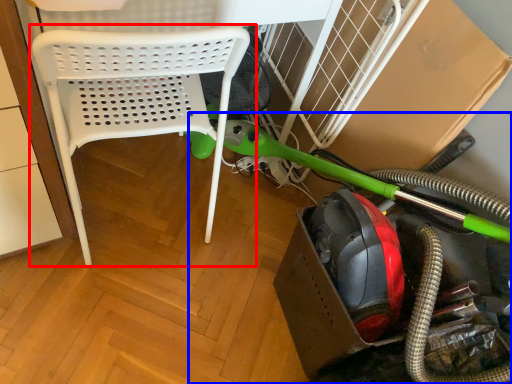
Question: Among these objects, which one is farthest to the camera, chair (highlighted by a red box) or garden hose (highlighted by a blue box)?

Choices:
 (A) chair
 (B) garden hose

Answer: (A)